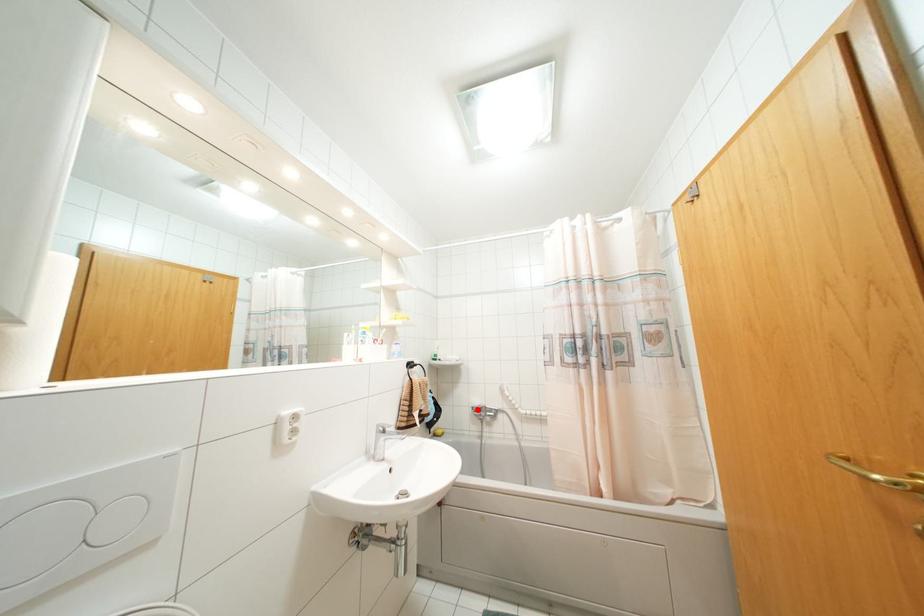
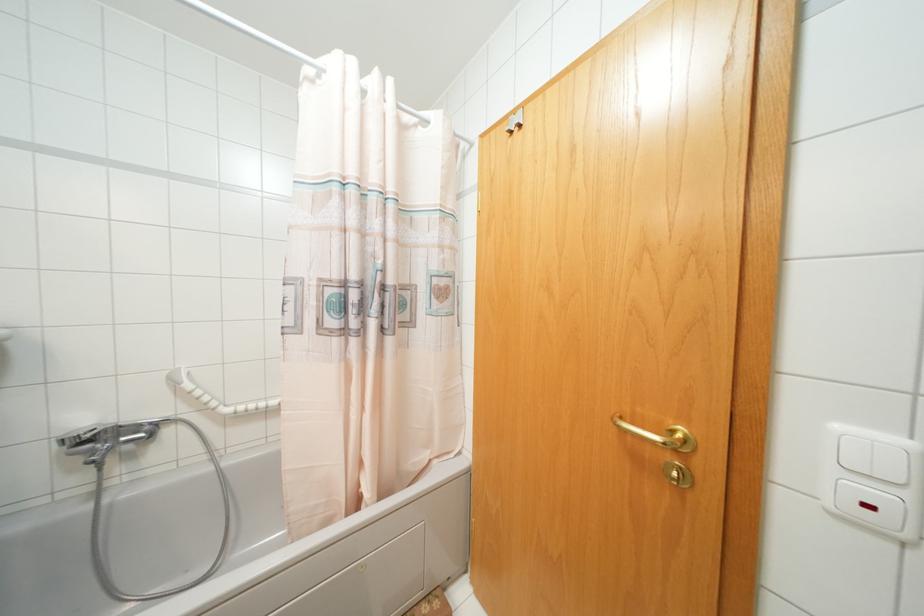
Where in the second image is the point corresponding to the highlighted location from the first image?

(84, 440)